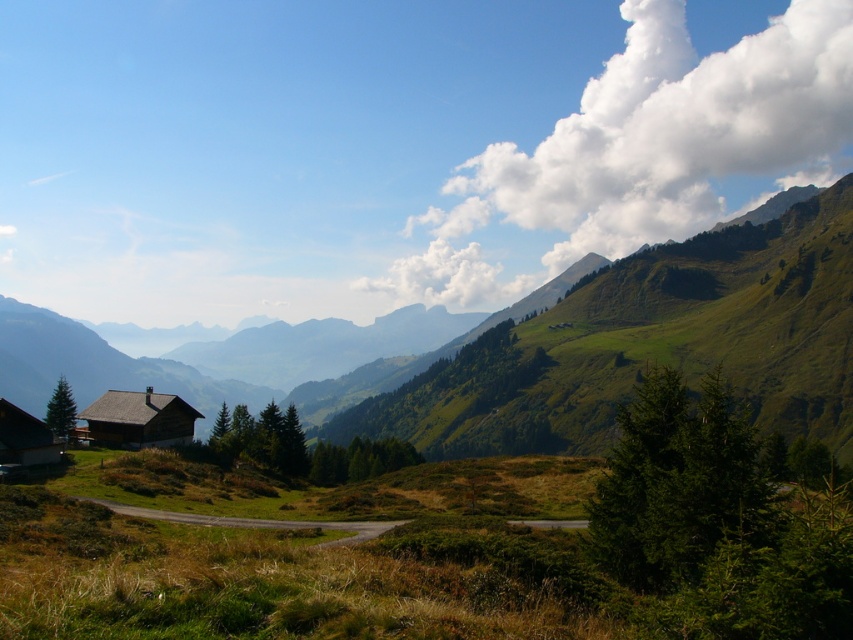
Question: Is wooden cabin at center to the left of wooden cabin at lower left from the viewer's perspective?

Choices:
 (A) yes
 (B) no

Answer: (B)

Question: Is wooden cabin at center thinner than wooden cabin at lower left?

Choices:
 (A) no
 (B) yes

Answer: (B)

Question: Does wooden cabin at center have a lesser width compared to wooden cabin at lower left?

Choices:
 (A) yes
 (B) no

Answer: (A)

Question: Which object is closer to the camera taking this photo?

Choices:
 (A) wooden cabin at center
 (B) wooden cabin at lower left

Answer: (B)